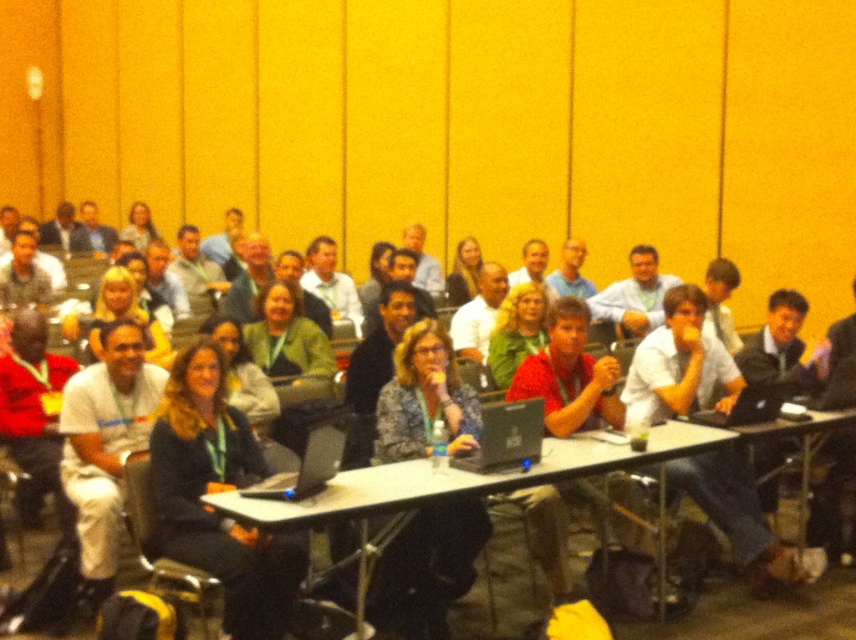
You are standing in the conference room and see a point marked at coordinates (x=210, y=506). Based on the scene description, which object is this point located on?

The point at coordinates (x=210, y=506) is located on the dark blue sweater at center.

You are a photographer standing at the back of the conference room. You want to take a photo of the dark blue sweater at center and the black matte laptop at center so that both are fully visible. Considering their heights, which object might block the view of the other in the photo?

The dark blue sweater at center is much taller than the black matte laptop at center, so it might block the view of the laptop in the photo.

You are organizing a photo shoot in this conference room and need to place a small podium between the dark blue sweater at center and the blue denim jacket at center. Based on their positions, where should the podium be placed relative to these two items?

The dark blue sweater at center is positioned on the left side of blue denim jacket at center, so the podium should be placed between them, to the right of the dark blue sweater at center and to the left of the blue denim jacket at center.